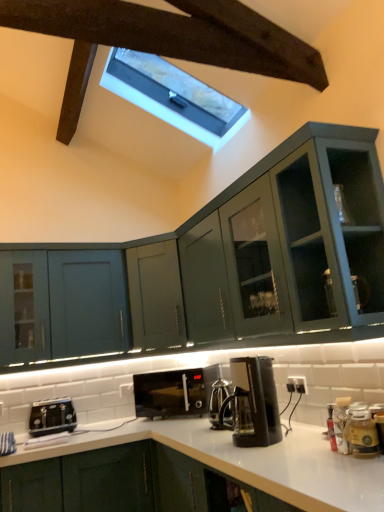
Question: Is translucent glass jar at lower right smaller than black matte microwave at center?

Choices:
 (A) yes
 (B) no

Answer: (A)

Question: Is translucent glass jar at lower right next to black matte microwave at center?

Choices:
 (A) yes
 (B) no

Answer: (B)

Question: Can you confirm if translucent glass jar at lower right is positioned to the left of black matte microwave at center?

Choices:
 (A) no
 (B) yes

Answer: (A)

Question: From the image's perspective, is translucent glass jar at lower right on black matte microwave at center?

Choices:
 (A) yes
 (B) no

Answer: (A)

Question: Is translucent glass jar at lower right positioned before black matte microwave at center?

Choices:
 (A) yes
 (B) no

Answer: (A)

Question: Considering the relative sizes of translucent glass jar at lower right and black matte microwave at center in the image provided, is translucent glass jar at lower right taller than black matte microwave at center?

Choices:
 (A) yes
 (B) no

Answer: (B)

Question: Is black plastic toaster at lower left facing away from black matte toaster at lower left, the second cabinetry from the top?

Choices:
 (A) yes
 (B) no

Answer: (B)

Question: Considering the relative sizes of black plastic toaster at lower left and black matte toaster at lower left, the second cabinetry from the top, in the image provided, is black plastic toaster at lower left wider than black matte toaster at lower left, the second cabinetry from the top,?

Choices:
 (A) yes
 (B) no

Answer: (B)

Question: Is black plastic toaster at lower left closer to the viewer compared to black matte toaster at lower left, arranged as the first cabinetry when ordered from the bottom?

Choices:
 (A) no
 (B) yes

Answer: (A)

Question: From the image's perspective, would you say black plastic toaster at lower left is shown under black matte toaster at lower left, arranged as the first cabinetry when ordered from the bottom?

Choices:
 (A) no
 (B) yes

Answer: (A)

Question: Is black plastic toaster at lower left not close to black matte toaster at lower left, the second cabinetry from the top?

Choices:
 (A) no
 (B) yes

Answer: (A)

Question: Considering the relative sizes of black plastic toaster at lower left and black matte toaster at lower left, arranged as the first cabinetry when ordered from the bottom, in the image provided, is black plastic toaster at lower left bigger than black matte toaster at lower left, arranged as the first cabinetry when ordered from the bottom,?

Choices:
 (A) yes
 (B) no

Answer: (B)

Question: Considering the relative positions of matte green cabinet at left, the 2th cabinetry positioned from the bottom, and translucent glass jar at lower right in the image provided, is matte green cabinet at left, the 2th cabinetry positioned from the bottom, behind translucent glass jar at lower right?

Choices:
 (A) no
 (B) yes

Answer: (B)